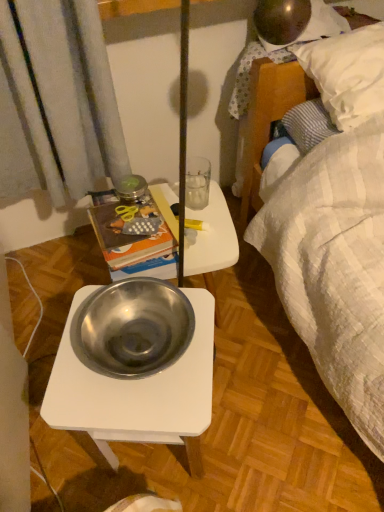
Question: Is polished stainless steel bowl at center outside hardcover book at upper left?

Choices:
 (A) yes
 (B) no

Answer: (A)

Question: Is polished stainless steel bowl at center oriented towards hardcover book at upper left?

Choices:
 (A) no
 (B) yes

Answer: (A)

Question: Can you confirm if polished stainless steel bowl at center is positioned to the right of hardcover book at upper left?

Choices:
 (A) no
 (B) yes

Answer: (B)

Question: Considering the relative sizes of polished stainless steel bowl at center and hardcover book at upper left in the image provided, is polished stainless steel bowl at center wider than hardcover book at upper left?

Choices:
 (A) yes
 (B) no

Answer: (B)

Question: Are polished stainless steel bowl at center and hardcover book at upper left making contact?

Choices:
 (A) yes
 (B) no

Answer: (B)

Question: Is metallic silver bowl at center wider or thinner than hardcover book at upper left?

Choices:
 (A) thin
 (B) wide

Answer: (B)

Question: Visually, is metallic silver bowl at center positioned to the left or to the right of hardcover book at upper left?

Choices:
 (A) left
 (B) right

Answer: (B)

Question: From a real-world perspective, relative to hardcover book at upper left, is metallic silver bowl at center vertically above or below?

Choices:
 (A) below
 (B) above

Answer: (A)

Question: Does point (213, 211) appear closer or farther from the camera than point (109, 229)?

Choices:
 (A) farther
 (B) closer

Answer: (A)

Question: Is metallic silver bowl at center wider or thinner than polished stainless steel bowl at center?

Choices:
 (A) thin
 (B) wide

Answer: (A)

Question: From a real-world perspective, relative to polished stainless steel bowl at center, is metallic silver bowl at center vertically above or below?

Choices:
 (A) above
 (B) below

Answer: (B)

Question: From the image's perspective, is metallic silver bowl at center above or below polished stainless steel bowl at center?

Choices:
 (A) above
 (B) below

Answer: (A)

Question: Considering the positions of metallic silver bowl at center and polished stainless steel bowl at center in the image, is metallic silver bowl at center taller or shorter than polished stainless steel bowl at center?

Choices:
 (A) short
 (B) tall

Answer: (A)

Question: From their relative heights in the image, would you say polished stainless steel bowl at center is taller or shorter than hardcover book at upper left?

Choices:
 (A) tall
 (B) short

Answer: (B)

Question: Would you say polished stainless steel bowl at center is to the left or to the right of hardcover book at upper left in the picture?

Choices:
 (A) right
 (B) left

Answer: (A)